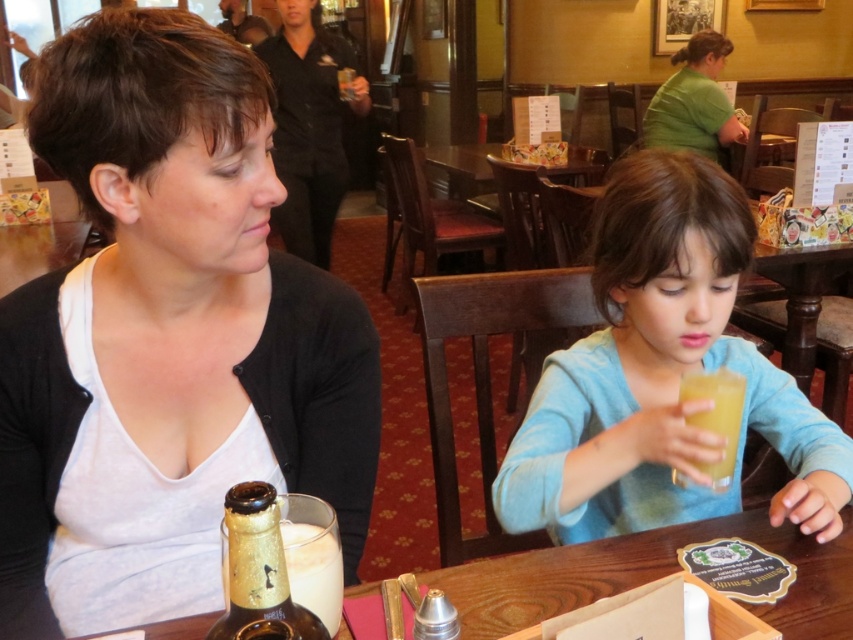
Consider the image. Can you confirm if light blue sweater at center is shorter than wooden table at center?

No.

Who is more distant from viewer, (714, 323) or (843, 634)?

Positioned behind is point (714, 323).

Where is `light blue sweater at center`? The height and width of the screenshot is (640, 853). light blue sweater at center is located at coordinates (660, 374).

Who is positioned more to the left, wooden table at center or translucent plastic cup at lower center?

wooden table at center is more to the left.

Is wooden table at center wider than translucent plastic cup at lower center?

Yes.

The height and width of the screenshot is (640, 853). Find the location of `wooden table at center`. wooden table at center is located at coordinates (648, 577).

The height and width of the screenshot is (640, 853). In order to click on wooden table at center in this screenshot , I will do `click(648, 577)`.

Between wooden table at center and gold metallic bottle at center, which one has more height?

With more height is gold metallic bottle at center.

Looking at this image, does wooden table at center have a lesser height compared to gold metallic bottle at center?

Indeed, wooden table at center has a lesser height compared to gold metallic bottle at center.

Between point (561, 557) and point (328, 637), which one is positioned in front?

Point (328, 637)

Find the location of a particular element. This screenshot has height=640, width=853. wooden table at center is located at coordinates (648, 577).